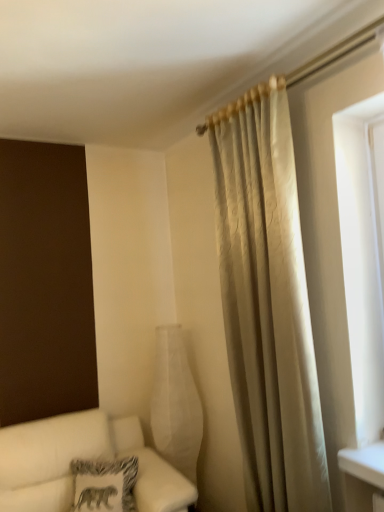
Describe the element at coordinates (175, 403) in the screenshot. Image resolution: width=384 pixels, height=512 pixels. I see `white matte glass vase at center` at that location.

Measure the distance between patterned fabric pillow at lower left and camera.

patterned fabric pillow at lower left and camera are 2.22 meters apart.

I want to click on patterned fabric pillow at lower left, so pos(104,484).

The height and width of the screenshot is (512, 384). What do you see at coordinates (267, 304) in the screenshot?
I see `silky beige curtain at right` at bounding box center [267, 304].

In order to click on white fabric couch at lower left in this screenshot , I will do `click(82, 457)`.

From the image's perspective, is patterned fabric pillow at lower left below silky beige curtain at right?

Yes, from the image's perspective, patterned fabric pillow at lower left is beneath silky beige curtain at right.

Is patterned fabric pillow at lower left closer to the viewer compared to silky beige curtain at right?

No, it is not.

Is point (74, 504) less distant than point (299, 326)?

No, (74, 504) is behind (299, 326).

Consider the image. Considering the relative sizes of patterned fabric pillow at lower left and silky beige curtain at right in the image provided, is patterned fabric pillow at lower left taller than silky beige curtain at right?

No.

Is silky beige curtain at right wider or thinner than white fabric couch at lower left?

Considering their sizes, silky beige curtain at right looks slimmer than white fabric couch at lower left.

Is silky beige curtain at right not near white fabric couch at lower left?

Indeed, silky beige curtain at right is not near white fabric couch at lower left.

Looking at this image, from a real-world perspective, who is located higher, silky beige curtain at right or white fabric couch at lower left?

silky beige curtain at right is physically above.

How far apart are silky beige curtain at right and patterned fabric pillow at lower left?

3.52 feet.

Are silky beige curtain at right and patterned fabric pillow at lower left far apart?

Yes, silky beige curtain at right and patterned fabric pillow at lower left are located far from each other.

Is silky beige curtain at right positioned with its back to patterned fabric pillow at lower left?

No, silky beige curtain at right is not facing the opposite direction of patterned fabric pillow at lower left.

Can patterned fabric pillow at lower left be found inside silky beige curtain at right?

No.

Where is `pillow below the white matte glass vase at center (from the image's perspective)`? This screenshot has width=384, height=512. pillow below the white matte glass vase at center (from the image's perspective) is located at coordinates (104, 484).

Between white matte glass vase at center and patterned fabric pillow at lower left, which one has larger width?

white matte glass vase at center.

Can you see white matte glass vase at center touching patterned fabric pillow at lower left?

white matte glass vase at center and patterned fabric pillow at lower left are not in contact.

From the image's perspective, would you say white matte glass vase at center is positioned over patterned fabric pillow at lower left?

Indeed, from the image's perspective, white matte glass vase at center is shown above patterned fabric pillow at lower left.

Does point (178, 336) appear closer or farther from the camera than point (278, 306)?

Point (178, 336) is farther from the camera than point (278, 306).

How many degrees apart are the facing directions of white matte glass vase at center and silky beige curtain at right?

They differ by 86.9 degrees in their facing directions.

Does white matte glass vase at center have a smaller size compared to silky beige curtain at right?

Correct, white matte glass vase at center occupies less space than silky beige curtain at right.

Which object is positioned more to the right, white matte glass vase at center or silky beige curtain at right?

A: From the viewer's perspective, silky beige curtain at right appears more on the right side.

Consider the image. Is patterned fabric pillow at lower left facing away from white fabric couch at lower left?

Yes, patterned fabric pillow at lower left's orientation is away from white fabric couch at lower left.

Is patterned fabric pillow at lower left situated inside white fabric couch at lower left or outside?

patterned fabric pillow at lower left lies within the bounds of white fabric couch at lower left.

Which object is more forward, patterned fabric pillow at lower left or white fabric couch at lower left?

white fabric couch at lower left is in front.

Does patterned fabric pillow at lower left have a smaller size compared to white fabric couch at lower left?

Correct, patterned fabric pillow at lower left occupies less space than white fabric couch at lower left.

Is patterned fabric pillow at lower left oriented away from white matte glass vase at center?

Correct, patterned fabric pillow at lower left is looking away from white matte glass vase at center.

Is patterned fabric pillow at lower left thinner than white matte glass vase at center?

Yes, patterned fabric pillow at lower left is thinner than white matte glass vase at center.

Is patterned fabric pillow at lower left situated inside white matte glass vase at center or outside?

The correct answer is: outside.

Find the location of a particular element. The width and height of the screenshot is (384, 512). pillow that appears below the silky beige curtain at right (from a real-world perspective) is located at coordinates (104, 484).

The width and height of the screenshot is (384, 512). Identify the location of curtain on the right of the white fabric couch at lower left. (267, 304).

Estimate the real-world distances between objects in this image. Which object is closer to silky beige curtain at right, white matte glass vase at center or patterned fabric pillow at lower left?

Among the two, white matte glass vase at center is located nearer to silky beige curtain at right.

Considering their positions, is silky beige curtain at right positioned closer to white matte glass vase at center than patterned fabric pillow at lower left?

patterned fabric pillow at lower left lies closer to white matte glass vase at center than the other object.

Based on their spatial positions, is silky beige curtain at right or white matte glass vase at center closer to white fabric couch at lower left?

The object closer to white fabric couch at lower left is white matte glass vase at center.

Which object lies further to the anchor point white matte glass vase at center, white fabric couch at lower left or patterned fabric pillow at lower left?

patterned fabric pillow at lower left lies further to white matte glass vase at center than the other object.

Considering their positions, is white matte glass vase at center positioned closer to white fabric couch at lower left than patterned fabric pillow at lower left?

patterned fabric pillow at lower left is positioned closer to the anchor white fabric couch at lower left.

Consider the image. Estimate the real-world distances between objects in this image. Which object is closer to white matte glass vase at center, patterned fabric pillow at lower left or silky beige curtain at right?

patterned fabric pillow at lower left lies closer to white matte glass vase at center than the other object.

Considering their positions, is white matte glass vase at center positioned closer to patterned fabric pillow at lower left than silky beige curtain at right?

Based on the image, white matte glass vase at center appears to be nearer to patterned fabric pillow at lower left.

Estimate the real-world distances between objects in this image. Which object is closer to white matte glass vase at center, white fabric couch at lower left or silky beige curtain at right?

Based on the image, white fabric couch at lower left appears to be nearer to white matte glass vase at center.

Locate an element on the screen. The width and height of the screenshot is (384, 512). curtain located between white fabric couch at lower left and white matte glass vase at center in the depth direction is located at coordinates (267, 304).

The width and height of the screenshot is (384, 512). What are the coordinates of `pillow between silky beige curtain at right and white fabric couch at lower left from top to bottom` in the screenshot? It's located at (104, 484).

Image resolution: width=384 pixels, height=512 pixels. Identify the location of glass vase between silky beige curtain at right and patterned fabric pillow at lower left vertically. tap(175, 403).

Locate an element on the screen. This screenshot has width=384, height=512. pillow between white fabric couch at lower left and white matte glass vase at center in the front-back direction is located at coordinates (104, 484).